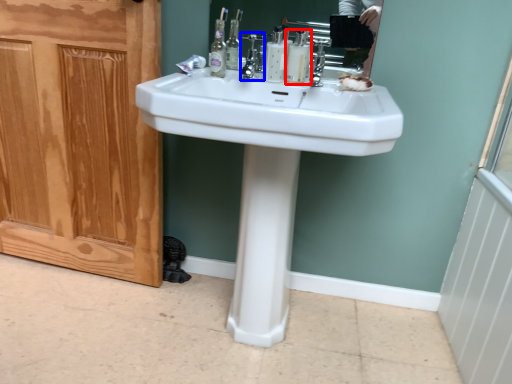
Question: Which object is closer to the camera taking this photo, mouthwash (highlighted by a red box) or faucet (highlighted by a blue box)?

Choices:
 (A) mouthwash
 (B) faucet

Answer: (B)